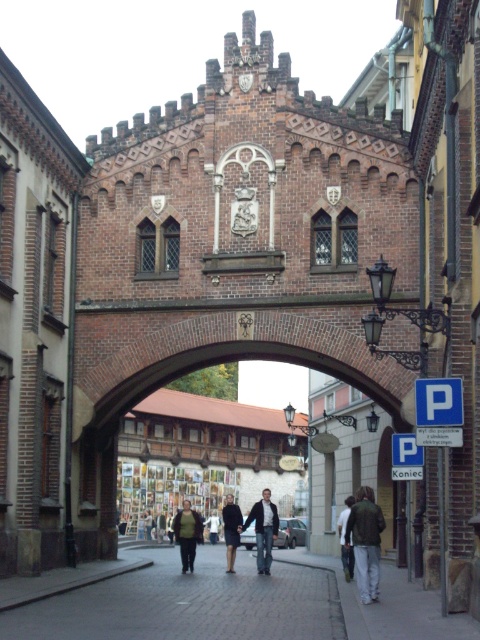
Question: Is brick pavement at center above dark blue skirt at center?

Choices:
 (A) no
 (B) yes

Answer: (A)

Question: Which is farther from the dark blue dress at center?

Choices:
 (A) green wool sweater at center
 (B) dark blue jeans at center

Answer: (B)

Question: Does green wool sweater at center come behind dark blue dress at center?

Choices:
 (A) yes
 (B) no

Answer: (B)

Question: Which object is the closest to the matte black coat at center?

Choices:
 (A) dark gray jacket at center
 (B) dark brown leather jacket at center

Answer: (A)

Question: Which point is closer to the camera?

Choices:
 (A) dark blue dress at center
 (B) brick pavement at center

Answer: (B)

Question: Does blue plastic parking sign at center lie in front of green wool sweater at center?

Choices:
 (A) no
 (B) yes

Answer: (B)